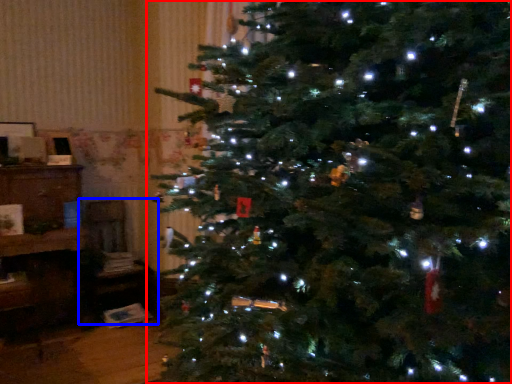
Question: Among these objects, which one is nearest to the camera, christmas tree (highlighted by a red box) or chair (highlighted by a blue box)?

Choices:
 (A) christmas tree
 (B) chair

Answer: (A)